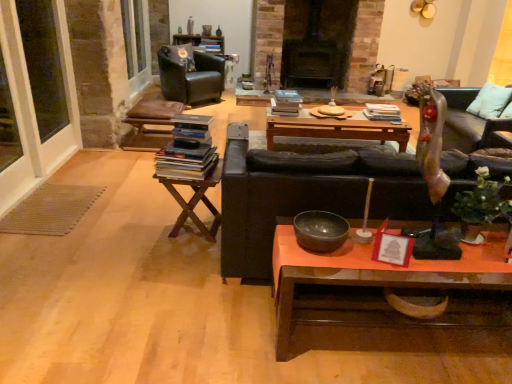
Locate an element on the screen. hardcover book at center, which is the 1th book in back-to-front order is located at coordinates (382, 112).

In the scene shown: Measure the distance between hardcover books at center, the second book positioned from the back, and camera.

A distance of 3.92 meters exists between hardcover books at center, the second book positioned from the back, and camera.

The width and height of the screenshot is (512, 384). What do you see at coordinates (320, 231) in the screenshot?
I see `matte black bowl at center` at bounding box center [320, 231].

From the picture: In order to face matte black bowl at center, should I rotate leftwards or rightwards?

Turn right by 8.718 degrees to look at matte black bowl at center.

What do you see at coordinates (392, 248) in the screenshot?
I see `matte red picture frame at center` at bounding box center [392, 248].

You are a GUI agent. You are given a task and a screenshot of the screen. Output one action in this format:
    pyautogui.click(x=<x>, y=<y>)
    Task: Click on the black leather armchair at upper left
    This screenshot has width=512, height=384.
    Given the screenshot: What is the action you would take?
    pyautogui.click(x=191, y=76)

The image size is (512, 384). Find the location of `hardcover book at center, marked as the third book in a left-to-right arrangement`. hardcover book at center, marked as the third book in a left-to-right arrangement is located at coordinates (382, 112).

Between hardcover books at center left, marked as the first book in a left-to-right arrangement, and black leather couch at center, which one is positioned behind?

hardcover books at center left, marked as the first book in a left-to-right arrangement.

Where is `studio couch located on the right of hardcover books at center left, marked as the first book in a left-to-right arrangement`? studio couch located on the right of hardcover books at center left, marked as the first book in a left-to-right arrangement is located at coordinates (305, 195).

Which of these two, hardcover books at center left, marked as the first book in a left-to-right arrangement, or black leather couch at center, stands taller?

Standing taller between the two is black leather couch at center.

Which of these two, hardcover books at center left, marked as the first book in a left-to-right arrangement, or black leather couch at center, is bigger?

black leather couch at center is bigger.

From a real-world perspective, is matte red picture frame at center physically below clear glass window screen at upper left?

Indeed, from a real-world perspective, matte red picture frame at center is positioned beneath clear glass window screen at upper left.

From the picture: Is matte red picture frame at center in front of clear glass window screen at upper left?

Yes, it is.

Consider the image. Is matte red picture frame at center inside the boundaries of clear glass window screen at upper left, or outside?

matte red picture frame at center is located beyond the bounds of clear glass window screen at upper left.

Is point (396, 236) behind point (28, 32)?

No.

Is hardcover books at center left, the 3th book from the top, positioned in front of matte black bowl at center?

That is False.

Which object is positioned more to the left, hardcover books at center left, which is counted as the 3th book, starting from the back, or matte black bowl at center?

hardcover books at center left, which is counted as the 3th book, starting from the back.

Considering the positions of point (193, 155) and point (311, 213), is point (193, 155) closer or farther from the camera than point (311, 213)?

Point (193, 155) appears to be farther away from the viewer than point (311, 213).

From the image's perspective, does hardcover books at center left, the first book when ordered from front to back, appear higher than matte black bowl at center?

Yes, from the image's perspective, hardcover books at center left, the first book when ordered from front to back, is on top of matte black bowl at center.

Which object is positioned more to the left, white fabric pillow at right or black leather couch at center?

Positioned to the left is black leather couch at center.

Which is behind, point (504, 110) or point (229, 201)?

The point (504, 110) is farther from the camera.

Would you say black leather couch at center is part of white fabric pillow at right's contents?

No, white fabric pillow at right does not contain black leather couch at center.

Can you confirm if matte black bowl at center is shorter than black leather couch at center?

Indeed, matte black bowl at center has a lesser height compared to black leather couch at center.

Could you tell me if matte black bowl at center is turned towards black leather couch at center?

No, matte black bowl at center does not turn towards black leather couch at center.

In terms of size, does matte black bowl at center appear bigger or smaller than black leather couch at center?

Clearly, matte black bowl at center is smaller in size than black leather couch at center.

Are woodenwoodentable at left and black leather couch at center located far from each other?

Actually, woodenwoodentable at left and black leather couch at center are a little close together.

Can you confirm if woodenwoodentable at left is shorter than black leather couch at center?

Indeed, woodenwoodentable at left has a lesser height compared to black leather couch at center.

From a real-world perspective, is woodenwoodentable at left located beneath black leather couch at center?

Yes.

Does woodenwoodentable at left appear on the left side of black leather couch at center?

Indeed, woodenwoodentable at left is positioned on the left side of black leather couch at center.

Looking at the image, does matte red picture frame at center seem bigger or smaller compared to matte black bowl at center?

Clearly, matte red picture frame at center is smaller in size than matte black bowl at center.

Which is farther from the camera, (398, 248) or (307, 243)?

Positioned behind is point (307, 243).

Between matte red picture frame at center and matte black bowl at center, which one appears on the right side from the viewer's perspective?

matte red picture frame at center.

Locate an element on the screen. The height and width of the screenshot is (384, 512). the 3rd book above the black leather couch at center (from a real-world perspective) is located at coordinates (185, 162).

Locate an element on the screen. The image size is (512, 384). picture frame below the clear glass window screen at upper left (from the image's perspective) is located at coordinates 392,248.

When comparing their distances from hardcover books at center left, which is counted as the 3th book, starting from the back, does wooden polished coffee table at center, marked as the 2th coffee table in a bottom-to-top arrangement, or clear glass window screen at upper left seem further?

Among the two, clear glass window screen at upper left is located further to hardcover books at center left, which is counted as the 3th book, starting from the back.

Considering their positions, is black leather couch at center positioned further to wooden polished coffee table at lower center, the 2th coffee table when ordered from top to bottom, than woodenwoodentable at left?

woodenwoodentable at left is further to wooden polished coffee table at lower center, the 2th coffee table when ordered from top to bottom.

Looking at the image, which one is located closer to hardcover books at center, acting as the 1th book starting from the top, wooden polished coffee table at center, which is the 1th coffee table in top-to-bottom order, or black leather couch at center?

wooden polished coffee table at center, which is the 1th coffee table in top-to-bottom order, is positioned closer to the anchor hardcover books at center, acting as the 1th book starting from the top.

Which object lies further to the anchor point wooden polished coffee table at center, acting as the 2th coffee table starting from the front, wooden polished coffee table at lower center, the 2th coffee table when ordered from top to bottom, or matte black bowl at center?

The object further to wooden polished coffee table at center, acting as the 2th coffee table starting from the front, is matte black bowl at center.

Which object lies nearer to the anchor point metallic silver couch at right, hardcover books at center left, which is the third book from right to left, or white fabric pillow at right?

hardcover books at center left, which is the third book from right to left, is closer to metallic silver couch at right.

When comparing their distances from hardcover books at center left, which is counted as the 3th book, starting from the back, does white fabric pillow at right or matte red picture frame at center seem further?

white fabric pillow at right is further to hardcover books at center left, which is counted as the 3th book, starting from the back.

Considering their positions, is black leather armchair at upper left positioned further to woodenwoodentable at left than hardcover books at center left, the first book when ordered from front to back?

black leather armchair at upper left is positioned further to the anchor woodenwoodentable at left.

Looking at this image, from the image, which object appears to be nearer to white fabric pillow at right, hardcover books at center, the 2th book positioned from the right, or matte red picture frame at center?

hardcover books at center, the 2th book positioned from the right, lies closer to white fabric pillow at right than the other object.

This screenshot has height=384, width=512. Find the location of `studio couch between wooden polished coffee table at lower center, which is the 1th coffee table from front to back, and white fabric pillow at right from front to back`. studio couch between wooden polished coffee table at lower center, which is the 1th coffee table from front to back, and white fabric pillow at right from front to back is located at coordinates (305, 195).

Image resolution: width=512 pixels, height=384 pixels. In order to click on table between matte red picture frame at center and wooden polished coffee table at center, marked as the 2th coffee table in a bottom-to-top arrangement, in the front-back direction in this screenshot , I will do `click(195, 201)`.

The image size is (512, 384). What are the coordinates of `book situated between wooden polished coffee table at center, marked as the 2th coffee table in a bottom-to-top arrangement, and metallic silver couch at right from left to right` in the screenshot? It's located at (382, 112).

I want to click on window screen between matte red picture frame at center and black leather armchair at upper left in the front-back direction, so click(42, 65).